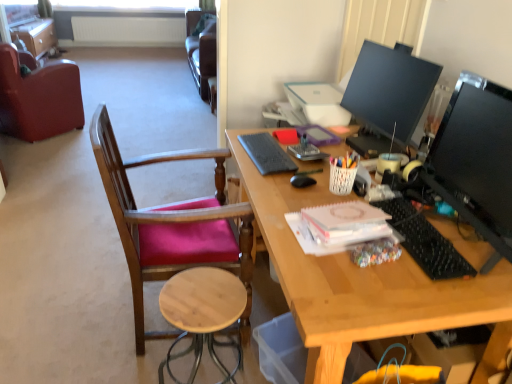
At what (x,y) coordinates should I click in order to perform the action: click on free space to the left of natural wood stool at lower center. Please return your answer as a coordinate pair (x, y). The height and width of the screenshot is (384, 512). Looking at the image, I should click on (125, 361).